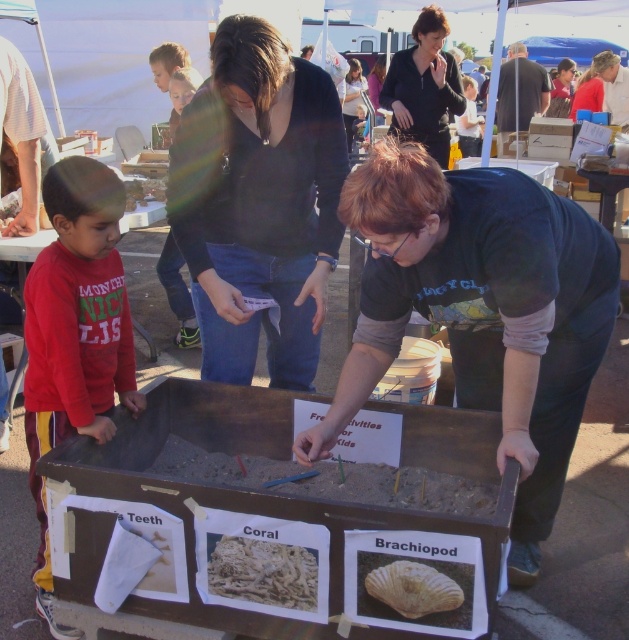
You are a photographer trying to capture a clear shot of the woman with short red hair. The black matte sweater at upper center and the matte black shirt at center are both visible in your viewfinder. Which clothing item is closer to the camera?

The black matte sweater at upper center is in front of the matte black shirt at center, so it is closer to the camera.

You are standing in front of the educational display table and notice two points marked on it. The first point is at coordinate point (496, 234) and the second is at point (615, 93). Which of these points is closer to you?

Point (496, 234) is closer to the viewer than point (615, 93).